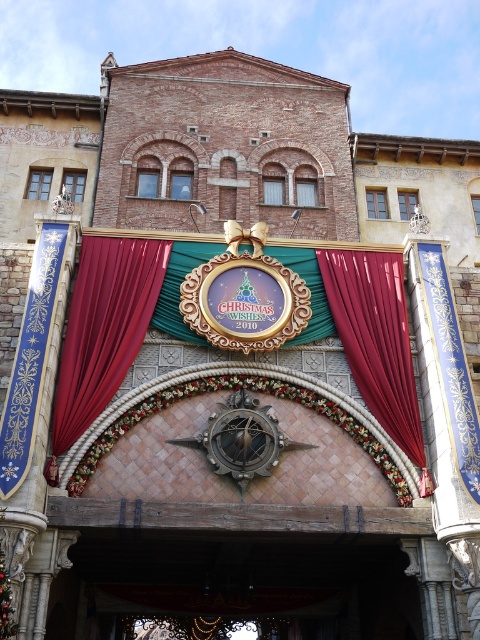
Question: Among these objects, which one is nearest to the camera?

Choices:
 (A) velvet red curtain at center
 (B) wooden door at center

Answer: (B)

Question: Does wooden door at center appear over red velvet curtain at center?

Choices:
 (A) yes
 (B) no

Answer: (B)

Question: Which object is farther from the camera taking this photo?

Choices:
 (A) wooden door at center
 (B) velvet red curtain at center
 (C) red velvet curtain at center

Answer: (C)

Question: Estimate the real-world distances between objects in this image. Which object is closer to the wooden door at center?

Choices:
 (A) red velvet curtain at center
 (B) velvet red curtain at center

Answer: (A)

Question: Is velvet red curtain at center smaller than red velvet curtain at center?

Choices:
 (A) yes
 (B) no

Answer: (A)

Question: Observing the image, what is the correct spatial positioning of velvet red curtain at center in reference to red velvet curtain at center?

Choices:
 (A) left
 (B) right

Answer: (A)